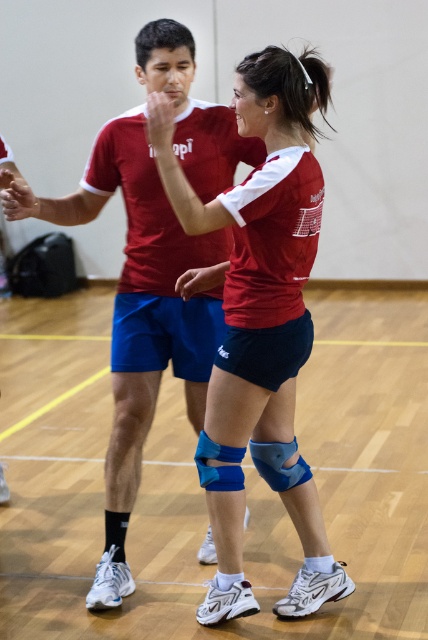
Based on the photo, you are a coach observing a volleyball practice. You notice the blue matte knee pads at center and the matte red shirt at center. Which object is positioned lower in the image?

The blue matte knee pads at center are positioned lower than the matte red shirt at center in the image.

In the gymnasium scene, there are two items at the center of the image. The blue matte knee pads at center and the matte red shirt at center. Which one is positioned to the right of the other?

The blue matte knee pads at center are to the right of the matte red shirt at center.

You are a coach observing a volleyball match and notice the blue matte knee pads at center and the matte red shirt at center. Which object takes up more horizontal space in the image?

The matte red shirt at center takes up more horizontal space than the blue matte knee pads at center because the blue matte knee pads at center has a lesser width compared to matte red shirt at center.